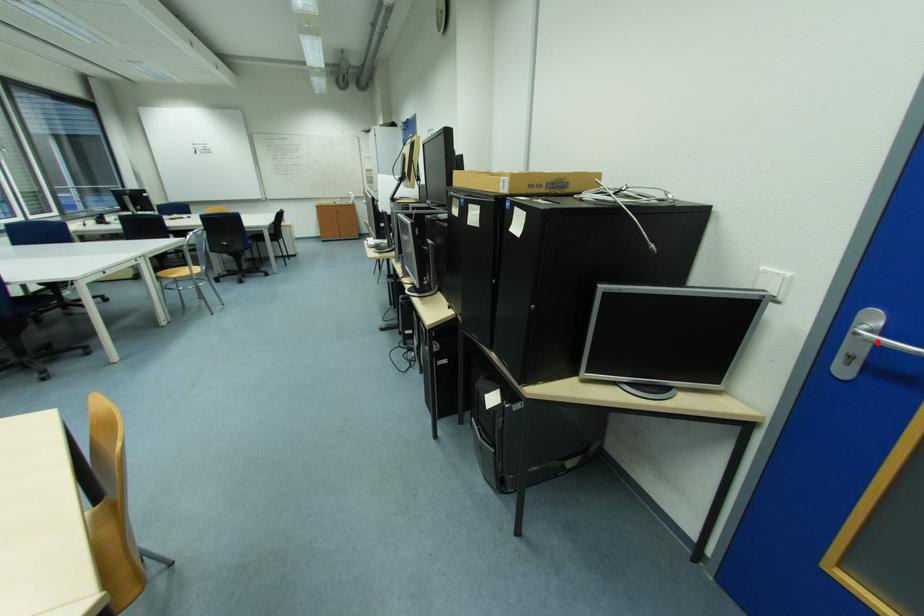
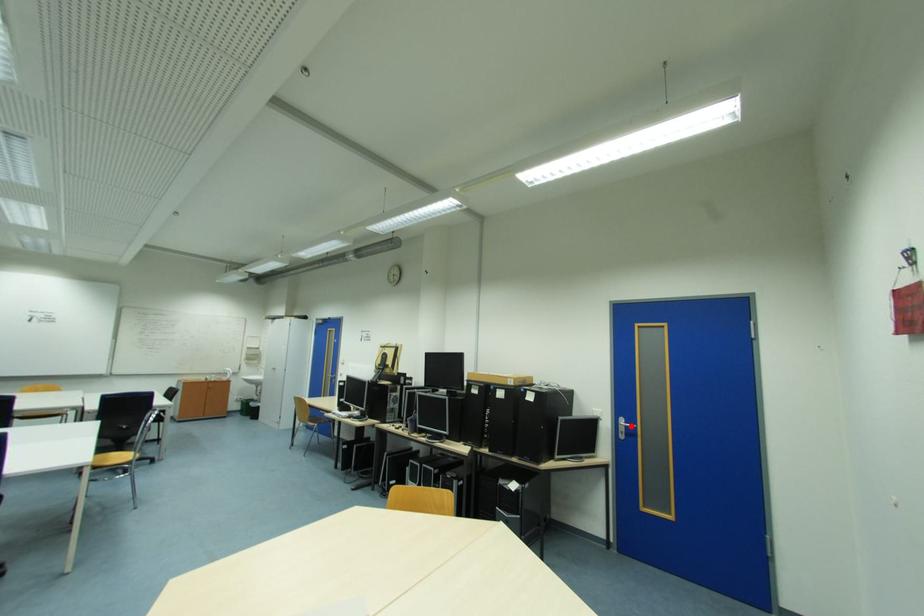
I am providing you with two images of the same scene from different viewpoints. A red point is marked on the first image and another point is marked on the second image. Is the marked point in image1 the same physical position as the marked point in image2?

Yes